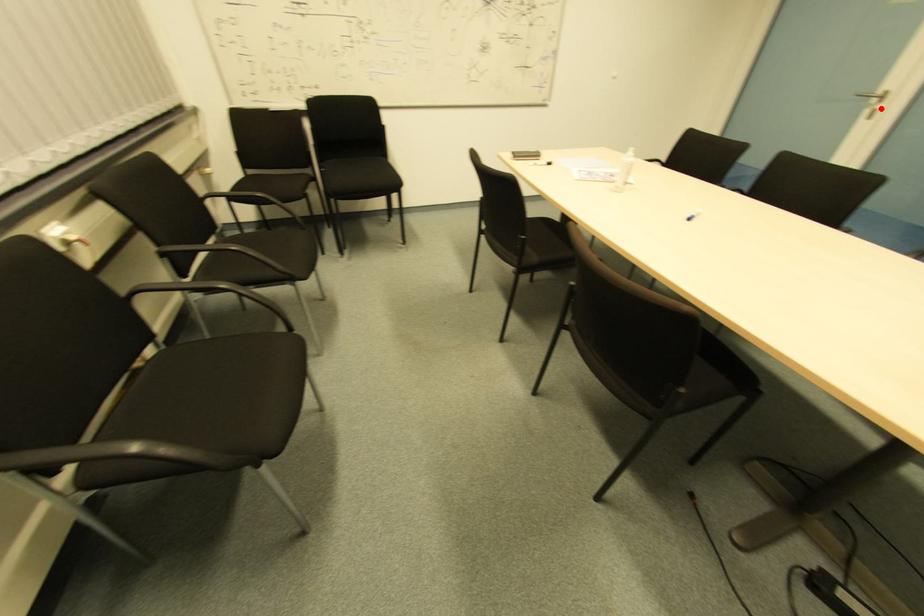
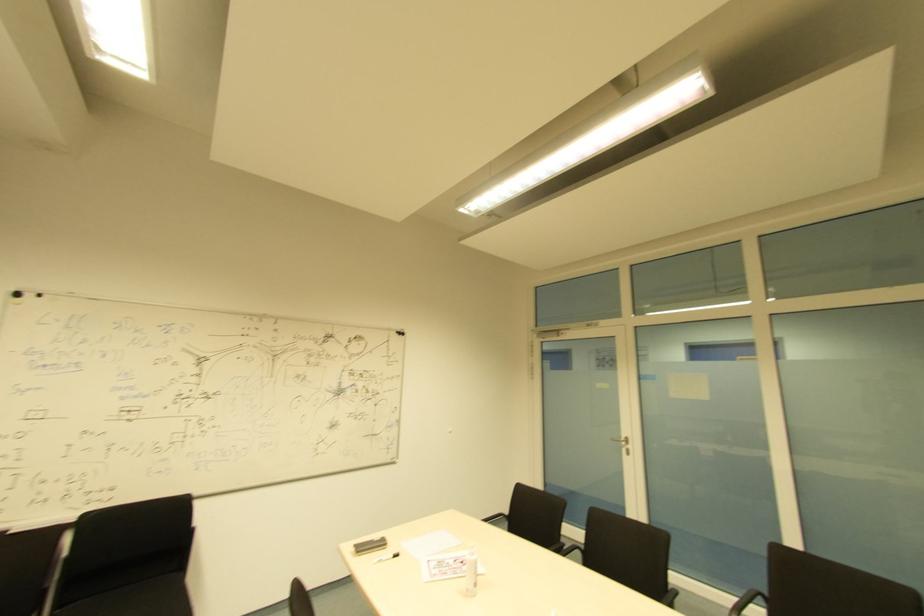
Where in the second image is the point corresponding to the highlighted location from the first image?

(628, 450)